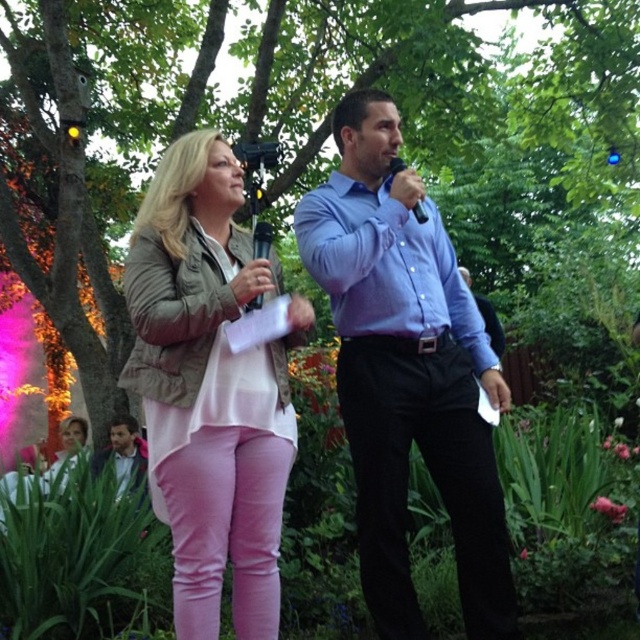
You are standing in the garden and want to place a small decorative item between the two points labeled point (134, 385) and point (272, 237). Which point should you place it closer to if you want it to appear larger in the image?

You should place the item closer to point (134, 385) because it is closer to the viewer, making the item appear larger in the image.